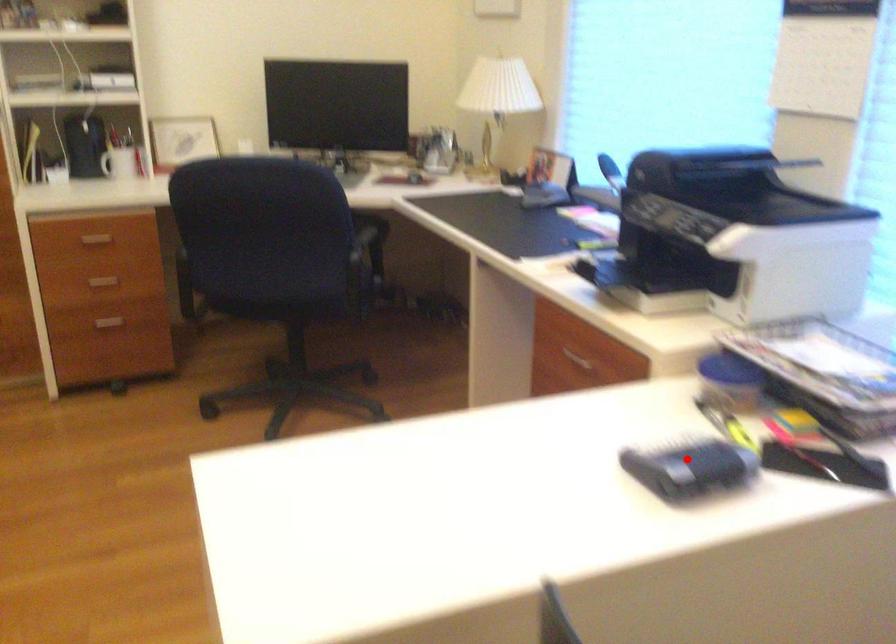
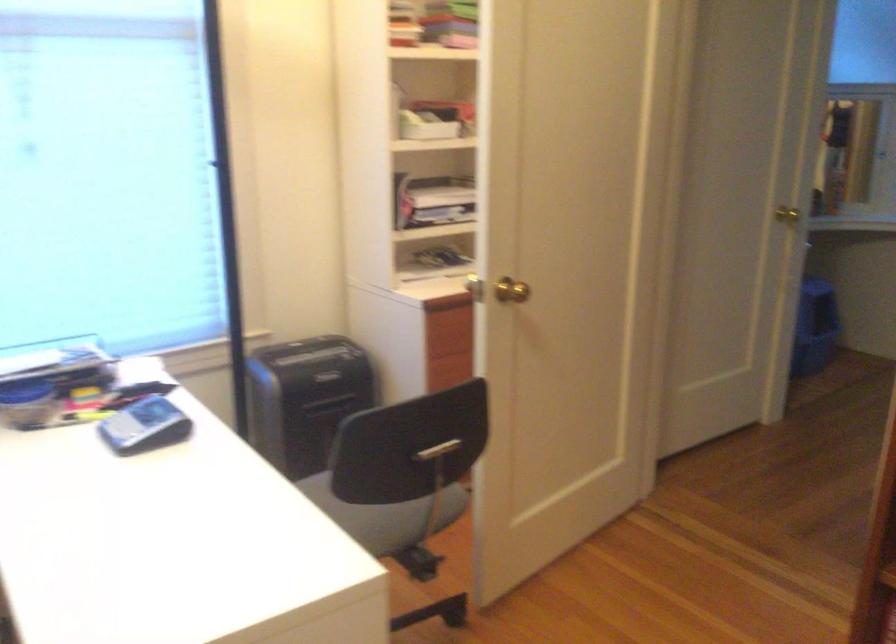
Question: I am providing you with two images of the same scene from different viewpoints. Given a red point in image1, look at the same physical point in image2. Is it:

Choices:
 (A) Closer to the viewpoint
 (B) Farther from the viewpoint

Answer: (B)